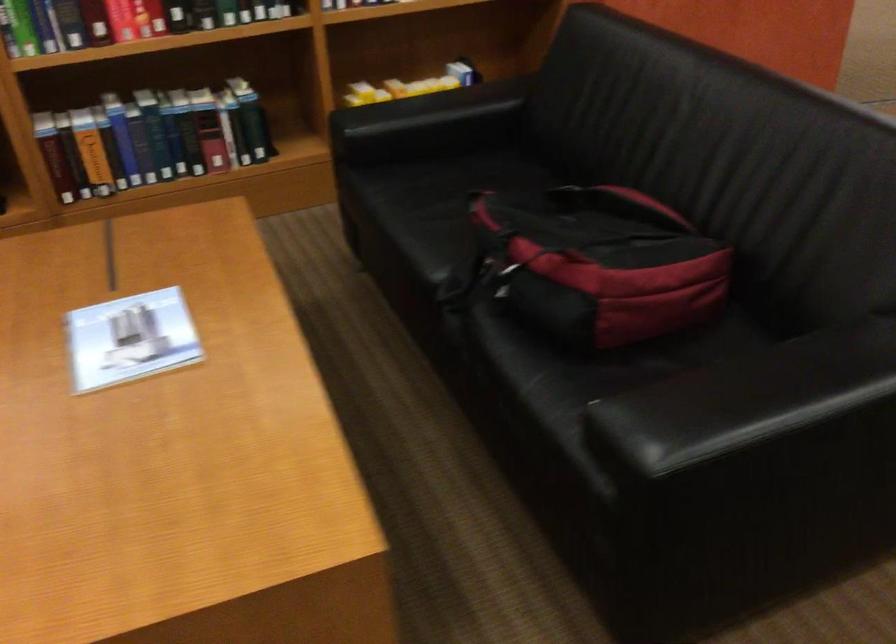
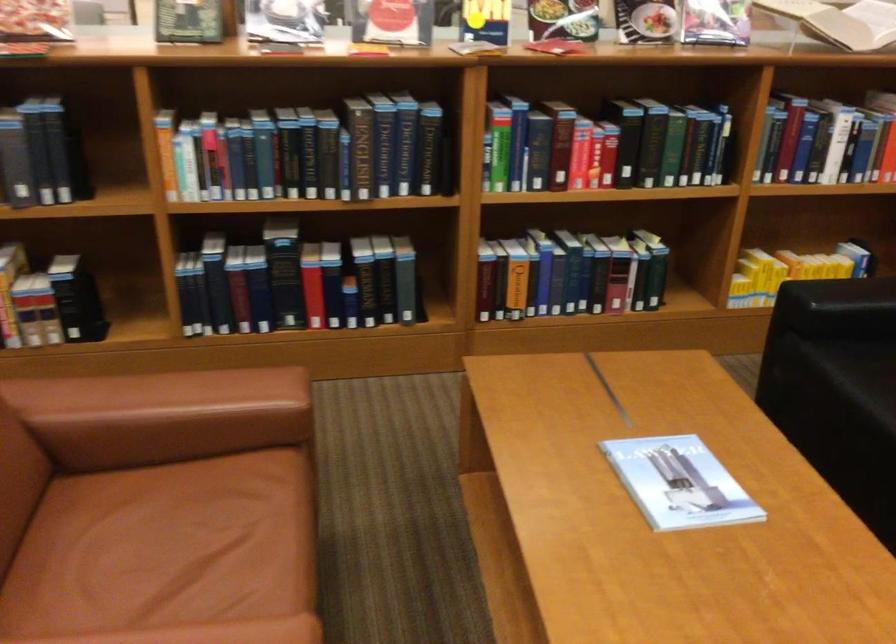
The point at (147, 339) is marked in the first image. Where is the corresponding point in the second image?

(678, 483)